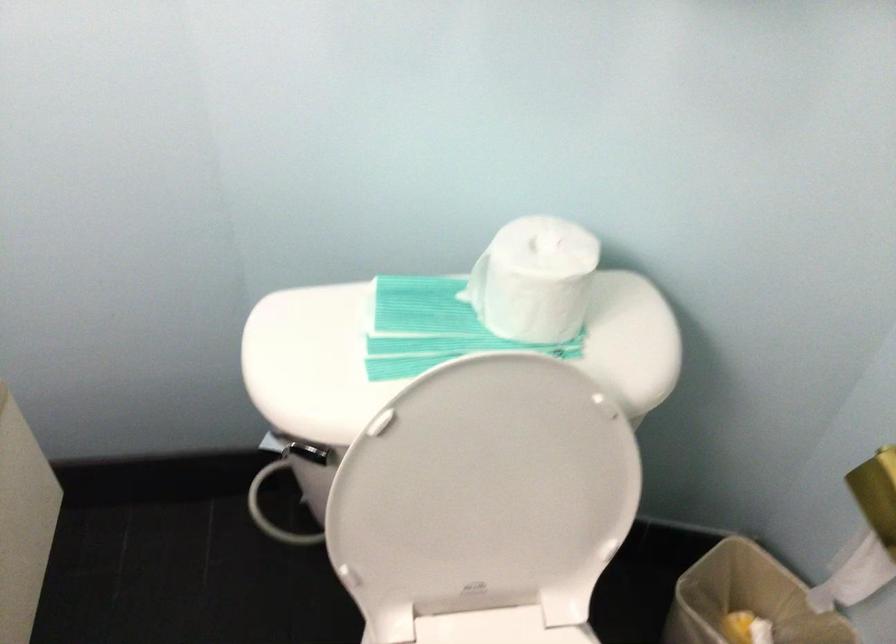
Question: The camera is either moving clockwise (left) or counter-clockwise (right) around the object. The first image is from the beginning of the video and the second image is from the end. Is the camera moving left or right when shooting the video?

Choices:
 (A) Left
 (B) Right

Answer: (B)